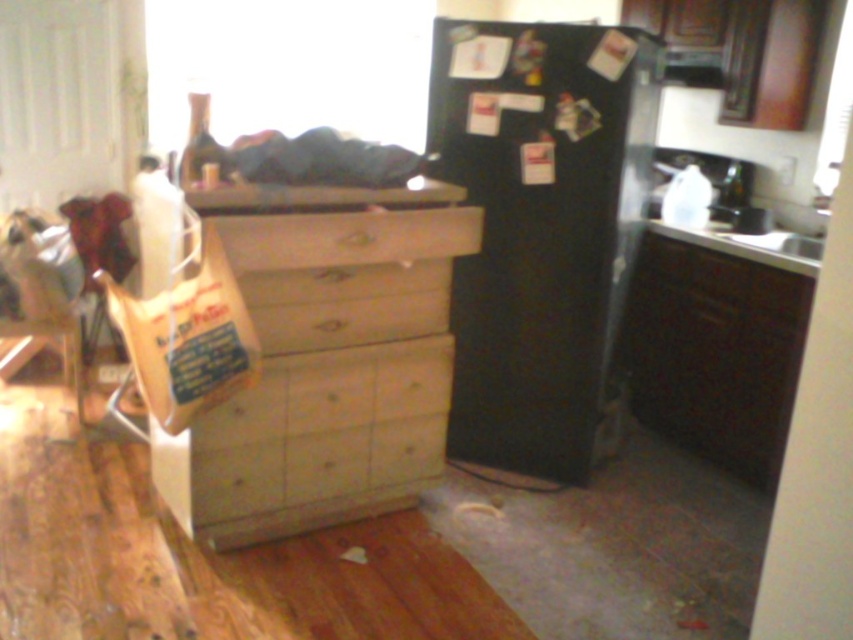
Is black matte refrigerator at center to the right of wooden drawer at center from the viewer's perspective?

Correct, you'll find black matte refrigerator at center to the right of wooden drawer at center.

Is point (477, 38) positioned before point (274, 218)?

No, (477, 38) is behind (274, 218).

Find the location of a particular element. The image size is (853, 640). black matte refrigerator at center is located at coordinates (540, 227).

Identify the location of black matte refrigerator at center. (540, 227).

Which of these two, black matte refrigerator at center or matte wood dresser at lower right, stands shorter?

matte wood dresser at lower right is shorter.

Is black matte refrigerator at center above matte wood dresser at lower right?

Indeed, black matte refrigerator at center is positioned over matte wood dresser at lower right.

Is point (508, 324) more distant than point (697, 454)?

No, it is in front of (697, 454).

Locate an element on the screen. black matte refrigerator at center is located at coordinates (540, 227).

Can you confirm if black matte refrigerator at center is wider than light wood dresser at center?

No.

Between black matte refrigerator at center and light wood dresser at center, which one has less height?

light wood dresser at center is shorter.

Identify the location of black matte refrigerator at center. (540, 227).